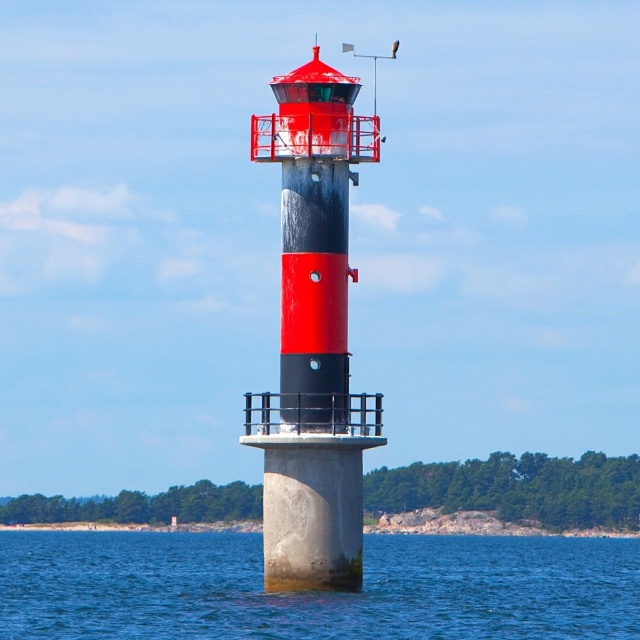
Question: Does blue concrete water at center appear on the right side of smooth concrete lighthouse at center?

Choices:
 (A) no
 (B) yes

Answer: (A)

Question: Is the position of blue concrete water at center more distant than that of smooth concrete lighthouse at center?

Choices:
 (A) no
 (B) yes

Answer: (A)

Question: Which point is farther to the camera?

Choices:
 (A) (589, 576)
 (B) (273, 404)

Answer: (A)

Question: Can you confirm if blue concrete water at center is positioned to the right of smooth concrete lighthouse at center?

Choices:
 (A) no
 (B) yes

Answer: (A)

Question: Which point is closer to the camera taking this photo?

Choices:
 (A) 339,352
 (B) 243,634

Answer: (B)

Question: Which point is closer to the camera?

Choices:
 (A) (262, 483)
 (B) (140, 596)

Answer: (A)